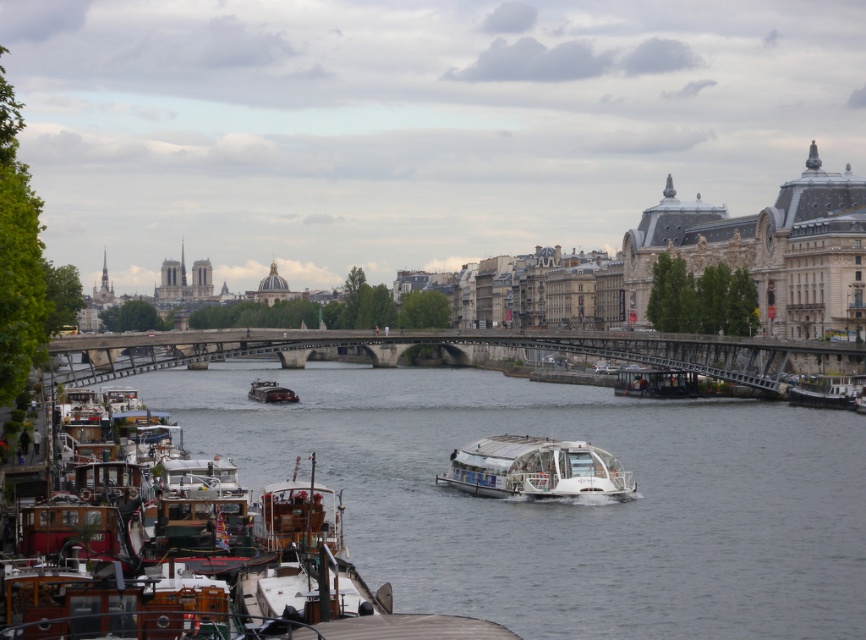
Between wooden boat at right and shiny dark brown boat at center, which one has more height?

Standing taller between the two is wooden boat at right.

Between point (792, 403) and point (251, 381), which one is positioned behind?

Positioned behind is point (251, 381).

Identify the location of wooden boat at right. Image resolution: width=866 pixels, height=640 pixels. (826, 392).

You are a GUI agent. You are given a task and a screenshot of the screen. Output one action in this format:
    pyautogui.click(x=<x>, y=<y>)
    Task: Click on the concrete bridge at center
    The image size is (866, 640).
    Given the screenshot: What is the action you would take?
    pyautogui.click(x=440, y=348)

Based on the photo, is concrete bridge at center further to camera compared to shiny dark brown boat at center?

No.

Between point (518, 346) and point (266, 397), which one is positioned in front?

Point (266, 397) is more forward.

Identify the location of concrete bridge at center. (440, 348).

Can you confirm if white glossy boat at lower center is positioned below white glossy boat at center?

Incorrect, white glossy boat at lower center is not positioned below white glossy boat at center.

This screenshot has width=866, height=640. In order to click on white glossy boat at lower center in this screenshot , I will do `click(561, 500)`.

This screenshot has width=866, height=640. In order to click on white glossy boat at lower center in this screenshot , I will do (561, 500).